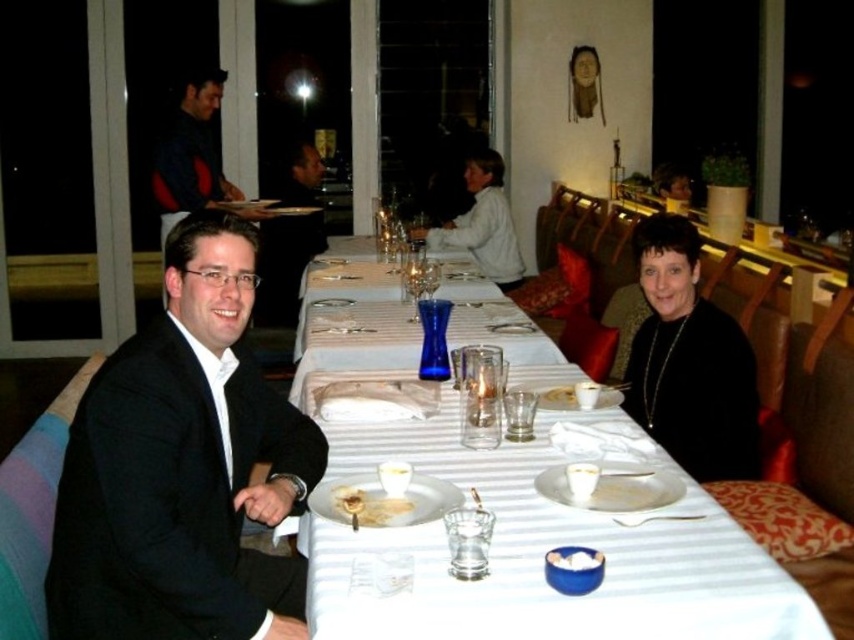
You are a waiter trying to place a new plate on the table. The plate needs to be placed at coordinates point A, which is at position 0.7, 0.5. Is the white striped tablecloth at center covering this point?

The white striped tablecloth at center is located at point [544,550], so the plate at [427,448] would be slightly to the left and below the tablecloth, meaning the tablecloth does not cover that point.

You are a server standing at the entrance of the restaurant, and you need to deliver a tray of appetizers to the table. The tray is 1.2 meters long. Can you walk straight to the white striped tablecloth at center without tilting the tray?

The white striped tablecloth at center is 1.23 meters away from viewer. Since the tray is 1.2 meters long, the server can walk straight to the white striped tablecloth at center without tilting the tray as the distance is sufficient.

You are a server in a restaurant and need to deliver a dessert to the table. The dessert needs to be placed between the black suit at left and the blue glass vase at center. Is there enough space to place the dessert plate between them?

The black suit at left and blue glass vase at center are 6.83 feet apart from each other, so yes, there is enough space to place the dessert plate between them as the distance is sufficient for a dessert plate.